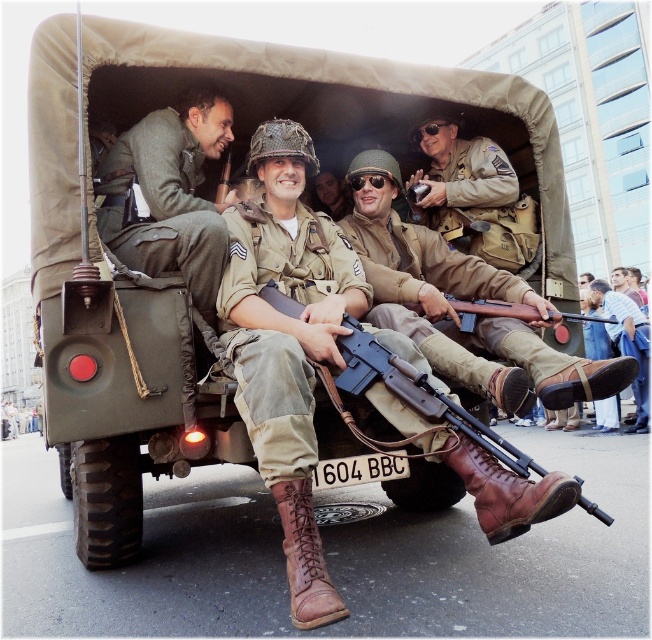
Question: Can you confirm if matte brown leather boots at center is smaller than matte brown rifle at center?

Choices:
 (A) yes
 (B) no

Answer: (B)

Question: Is matte green uniform at center above khaki uniform at center?

Choices:
 (A) yes
 (B) no

Answer: (B)

Question: Among these points, which one is farthest from the camera?

Choices:
 (A) (447, 356)
 (B) (98, 230)

Answer: (B)

Question: Among these objects, which one is nearest to the camera?

Choices:
 (A) leather shoe at lower right
 (B) matte brown leather boots at center
 (C) tan leather boots at center

Answer: (B)

Question: Which of the following is the closest to the observer?

Choices:
 (A) leather shoe at lower right
 (B) khaki uniform at center
 (C) matte brown rifle at center

Answer: (C)

Question: Is matte brown leather boots at center above leather shoe at lower right?

Choices:
 (A) yes
 (B) no

Answer: (A)